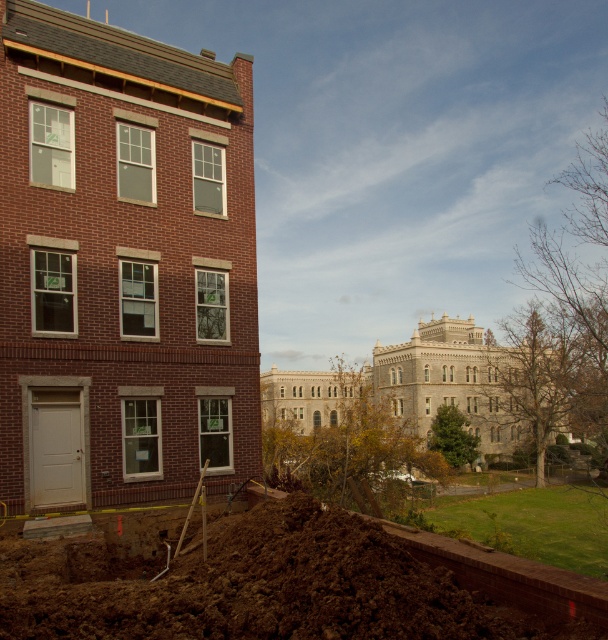
Question: Is brick building at left wider than brown soil at lower left?

Choices:
 (A) no
 (B) yes

Answer: (B)

Question: Which point appears closest to the camera in this image?

Choices:
 (A) (384, 620)
 (B) (50, 365)

Answer: (A)

Question: Which point appears farthest from the camera in this image?

Choices:
 (A) (207, 312)
 (B) (153, 624)

Answer: (A)

Question: Observing the image, what is the correct spatial positioning of brick building at left in reference to brown soil at lower left?

Choices:
 (A) left
 (B) right

Answer: (A)

Question: Considering the relative positions of brick building at left and brown soil at lower left in the image provided, where is brick building at left located with respect to brown soil at lower left?

Choices:
 (A) left
 (B) right

Answer: (A)

Question: Which of the following is the closest to the observer?

Choices:
 (A) brown soil at lower left
 (B) brick building at left

Answer: (A)